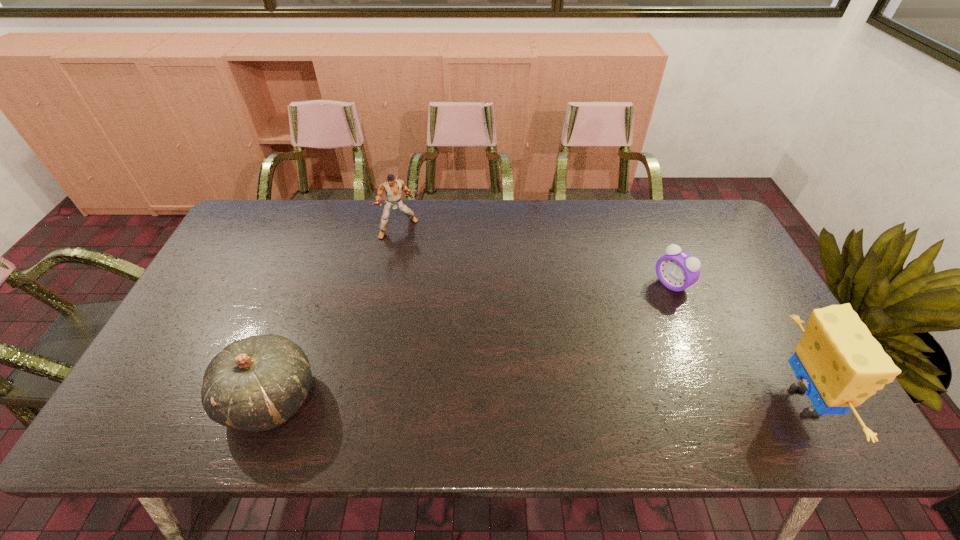
The width and height of the screenshot is (960, 540). Find the location of `free spot between the third object from left to right and the puncher`. free spot between the third object from left to right and the puncher is located at coordinates (535, 256).

The width and height of the screenshot is (960, 540). I want to click on vacant space that is in between the shortest object and the sponge, so click(x=736, y=342).

This screenshot has height=540, width=960. Identify the location of blank region between the puncher and the alarm clock. (535, 256).

Locate an element on the screen. Image resolution: width=960 pixels, height=540 pixels. vacant point located between the second shortest object and the rightmost object is located at coordinates (536, 400).

Where is `free space between the second shortest object and the second farthest object`? This screenshot has height=540, width=960. free space between the second shortest object and the second farthest object is located at coordinates (470, 341).

Image resolution: width=960 pixels, height=540 pixels. Identify the location of empty space that is in between the shortest object and the leftmost object. (470, 341).

Where is `free space that is in between the farthest object and the gourd`? This screenshot has width=960, height=540. free space that is in between the farthest object and the gourd is located at coordinates (334, 313).

Find the location of `object that stands as the second closest to the gourd`. object that stands as the second closest to the gourd is located at coordinates (677, 270).

The height and width of the screenshot is (540, 960). I want to click on the third closest object to the third tallest object, so click(x=841, y=364).

Locate an element on the screen. Image resolution: width=960 pixels, height=540 pixels. free space that satisfies the following two spatial constraints: 1. on the front side of the gourd; 2. on the face of the tallest object is located at coordinates (269, 401).